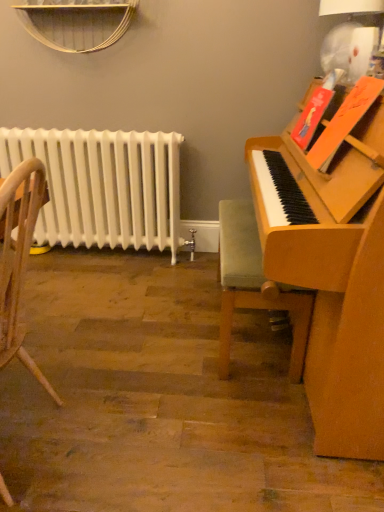
Question: From the image's perspective, is velvet green cushioned chair at right, the 1th chair viewed from the right, located above or below white painted metal radiator at left?

Choices:
 (A) below
 (B) above

Answer: (A)

Question: Is velvet green cushioned chair at right, the first chair in the back-to-front sequence, wider or thinner than white painted metal radiator at left?

Choices:
 (A) wide
 (B) thin

Answer: (A)

Question: Which is nearer to the wooden chair at left, the 1th chair when ordered from left to right?

Choices:
 (A) white painted metal radiator at left
 (B) velvet green cushioned chair at right, the first chair in the back-to-front sequence

Answer: (B)

Question: Estimate the real-world distances between objects in this image. Which object is farther from the white painted metal radiator at left?

Choices:
 (A) velvet green cushioned chair at right, placed as the second chair when sorted from front to back
 (B) wooden chair at left, arranged as the first chair when viewed from the front

Answer: (B)